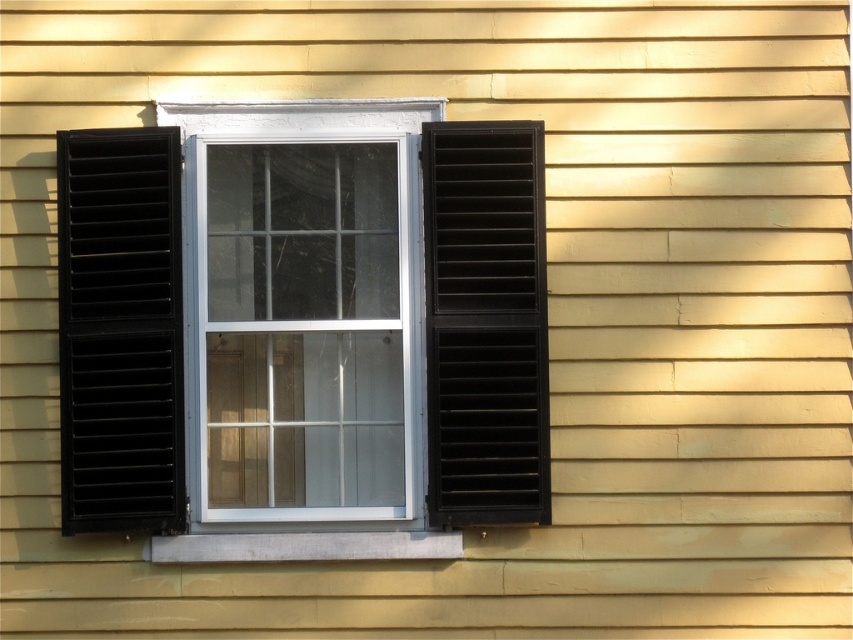
Measure the distance between black matte/shiny wood shutter at left and matte black shutter at right.

black matte/shiny wood shutter at left and matte black shutter at right are 34.83 inches apart from each other.

Image resolution: width=853 pixels, height=640 pixels. What do you see at coordinates (120, 330) in the screenshot?
I see `black matte/shiny wood shutter at left` at bounding box center [120, 330].

Where is `black matte/shiny wood shutter at left`? This screenshot has width=853, height=640. black matte/shiny wood shutter at left is located at coordinates (120, 330).

The width and height of the screenshot is (853, 640). What do you see at coordinates (305, 332) in the screenshot?
I see `white plastic window at center` at bounding box center [305, 332].

Who is positioned more to the right, white plastic window at center or black matte/shiny wood shutter at left?

→ white plastic window at center is more to the right.

Between point (296, 259) and point (149, 424), which one is positioned behind?

The point (296, 259) is behind.

Locate an element on the screen. Image resolution: width=853 pixels, height=640 pixels. white plastic window at center is located at coordinates (305, 332).

Can you confirm if white plastic window at center is positioned to the right of smooth concrete sill at lower center?

Incorrect, white plastic window at center is not on the right side of smooth concrete sill at lower center.

Can you confirm if white plastic window at center is taller than smooth concrete sill at lower center?

Indeed, white plastic window at center has a greater height compared to smooth concrete sill at lower center.

Describe the element at coordinates (305, 332) in the screenshot. I see `white plastic window at center` at that location.

This screenshot has height=640, width=853. I want to click on white plastic window at center, so click(x=305, y=332).